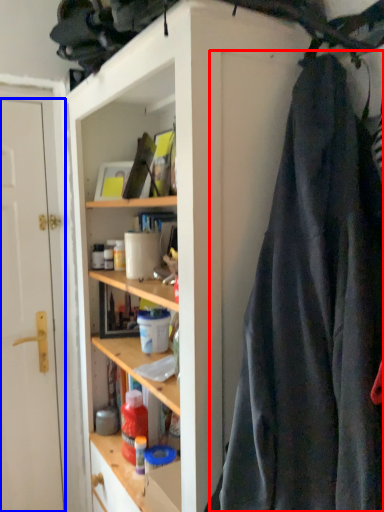
Question: Among these objects, which one is nearest to the camera, clothing (highlighted by a red box) or door (highlighted by a blue box)?

Choices:
 (A) clothing
 (B) door

Answer: (A)